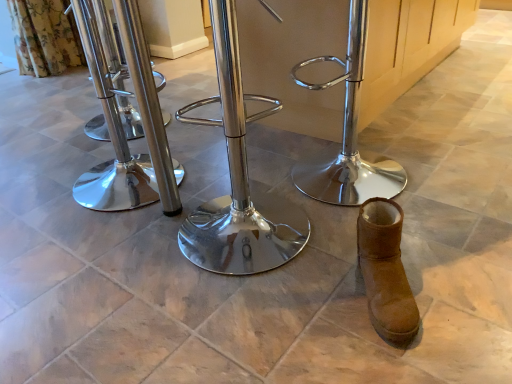
The image size is (512, 384). What are the coordinates of `free space between polished metal swivel chair at center, marked as the first swivel chair in a left-to-right arrangement, and polished metal swivel chair at center, positioned as the 1th swivel chair in right-to-left order` in the screenshot? It's located at (226, 178).